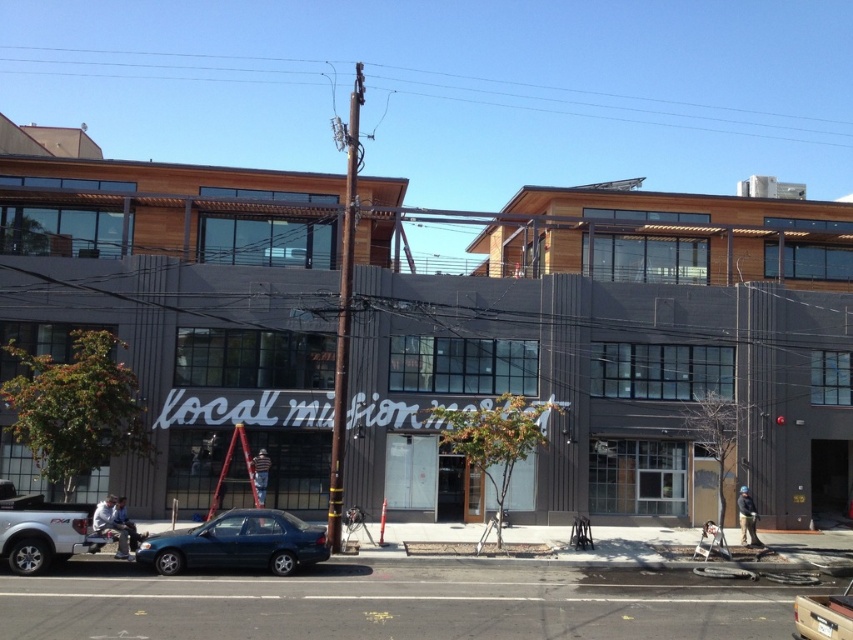
Question: Is matte black sign at center to the right of metallic silver truck at center from the viewer's perspective?

Choices:
 (A) yes
 (B) no

Answer: (B)

Question: Can you confirm if white matte truck at lower left is positioned below metallic silver truck at center?

Choices:
 (A) no
 (B) yes

Answer: (A)

Question: Which point is farther to the camera?

Choices:
 (A) (16, 572)
 (B) (236, 528)
 (C) (280, 218)
 (D) (810, 595)

Answer: (C)

Question: Among these objects, which one is farthest from the camera?

Choices:
 (A) white matte truck at lower left
 (B) teal matte sedan at center

Answer: (B)

Question: Among these points, which one is farthest from the camera?

Choices:
 (A) (231, 540)
 (B) (786, 355)
 (C) (10, 541)

Answer: (B)

Question: Considering the relative positions of matte black sign at center and teal matte sedan at center in the image provided, where is matte black sign at center located with respect to teal matte sedan at center?

Choices:
 (A) right
 (B) left

Answer: (A)